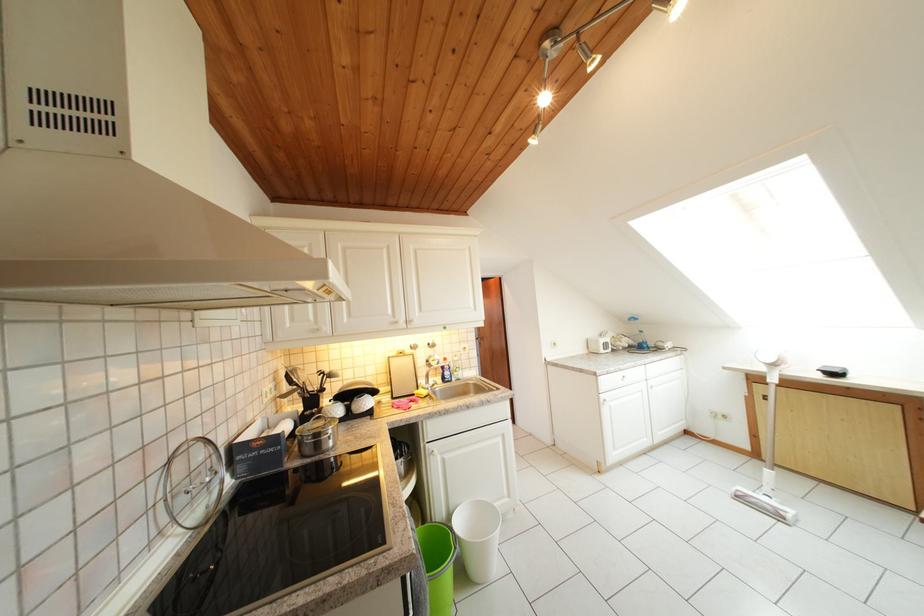
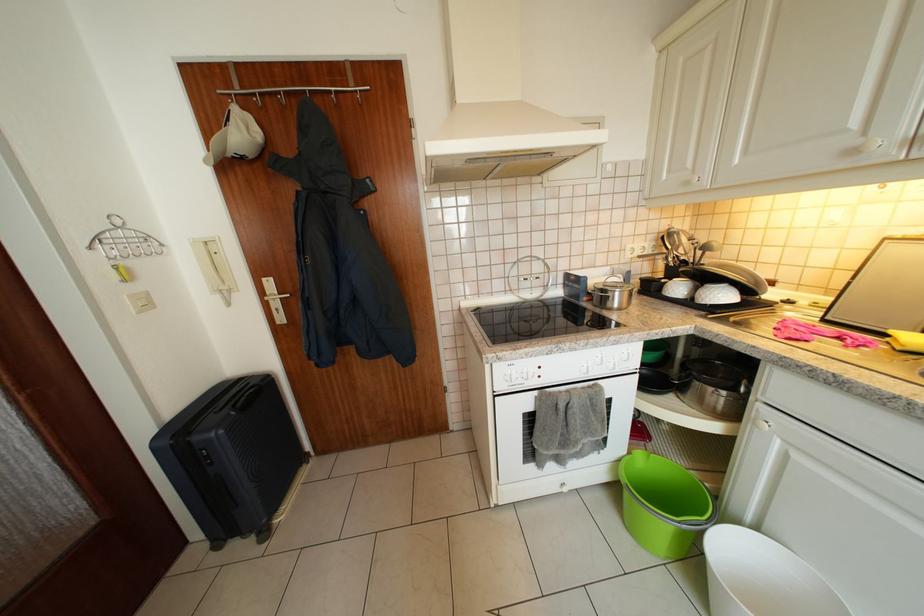
The images are taken continuously from a first-person perspective. In which direction is your viewpoint rotating?

The camera's rotation is toward left-down.